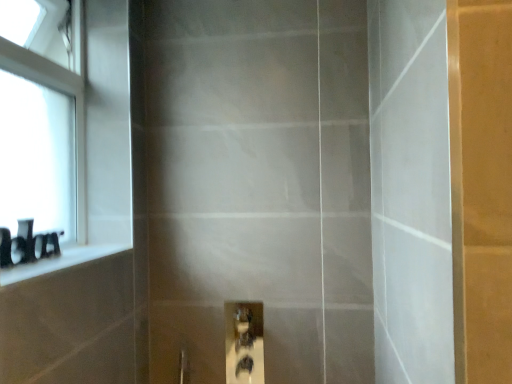
Question: Should I look upward or downward to see black matte toiletries at left?

Choices:
 (A) down
 (B) up

Answer: (A)

Question: Could black glossy ledge at left be considered to be inside matte glass screen door at center?

Choices:
 (A) yes
 (B) no

Answer: (B)

Question: From a real-world perspective, is matte glass screen door at center physically below black glossy ledge at left?

Choices:
 (A) no
 (B) yes

Answer: (A)

Question: Considering the relative sizes of matte glass screen door at center and black glossy ledge at left in the image provided, is matte glass screen door at center thinner than black glossy ledge at left?

Choices:
 (A) yes
 (B) no

Answer: (B)

Question: From the image's perspective, does matte glass screen door at center appear higher than black glossy ledge at left?

Choices:
 (A) no
 (B) yes

Answer: (B)

Question: Is matte glass screen door at center outside black glossy ledge at left?

Choices:
 (A) yes
 (B) no

Answer: (A)

Question: Could you tell me if matte glass screen door at center is facing black glossy ledge at left?

Choices:
 (A) yes
 (B) no

Answer: (B)

Question: Is white glass window at upper left further to the viewer compared to matte glass screen door at center?

Choices:
 (A) no
 (B) yes

Answer: (B)

Question: Is matte glass screen door at center completely or partially inside white glass window at upper left?

Choices:
 (A) no
 (B) yes

Answer: (A)

Question: Is white glass window at upper left outside matte glass screen door at center?

Choices:
 (A) no
 (B) yes

Answer: (B)

Question: Is white glass window at upper left to the right of matte glass screen door at center from the viewer's perspective?

Choices:
 (A) yes
 (B) no

Answer: (B)

Question: Does white glass window at upper left touch matte glass screen door at center?

Choices:
 (A) yes
 (B) no

Answer: (B)

Question: Would you consider white glass window at upper left to be distant from matte glass screen door at center?

Choices:
 (A) yes
 (B) no

Answer: (B)

Question: Is black matte toiletries at left at the back of black glossy ledge at left?

Choices:
 (A) yes
 (B) no

Answer: (B)